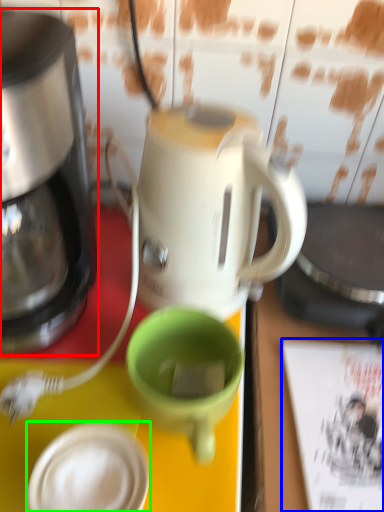
Question: Based on their relative distances, which object is farther from coffee maker (highlighted by a red box)? Choose from magazine (highlighted by a blue box) and tableware (highlighted by a green box).

Choices:
 (A) magazine
 (B) tableware

Answer: (A)